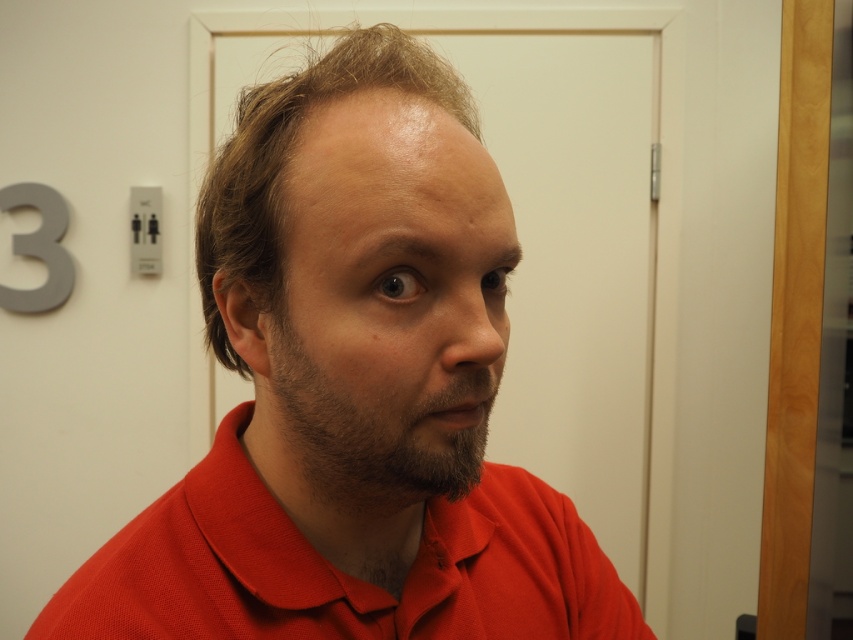
Between red matte shirt at center and matte red polo shirt at center, which one has more height?

With more height is red matte shirt at center.

Is red matte shirt at center closer to the viewer compared to matte red polo shirt at center?

Yes.

This screenshot has height=640, width=853. Identify the location of red matte shirt at center. (352, 390).

Can you confirm if red matte shirt at center is smaller than brown fuzzy beard at center?

No, red matte shirt at center is not smaller than brown fuzzy beard at center.

Which is above, red matte shirt at center or brown fuzzy beard at center?

brown fuzzy beard at center is above.

Who is more forward, (364, 186) or (474, 426)?

Point (364, 186)

I want to click on red matte shirt at center, so click(x=352, y=390).

Is red matte shirt at center closer to camera compared to brown matte hair at center?

Yes, red matte shirt at center is closer to the viewer.

Between red matte shirt at center and brown matte hair at center, which one has less height?

brown matte hair at center is shorter.

Does point (132, 630) lie in front of point (196, 250)?

Yes, point (132, 630) is closer to viewer.

Identify the location of red matte shirt at center. The width and height of the screenshot is (853, 640). (352, 390).